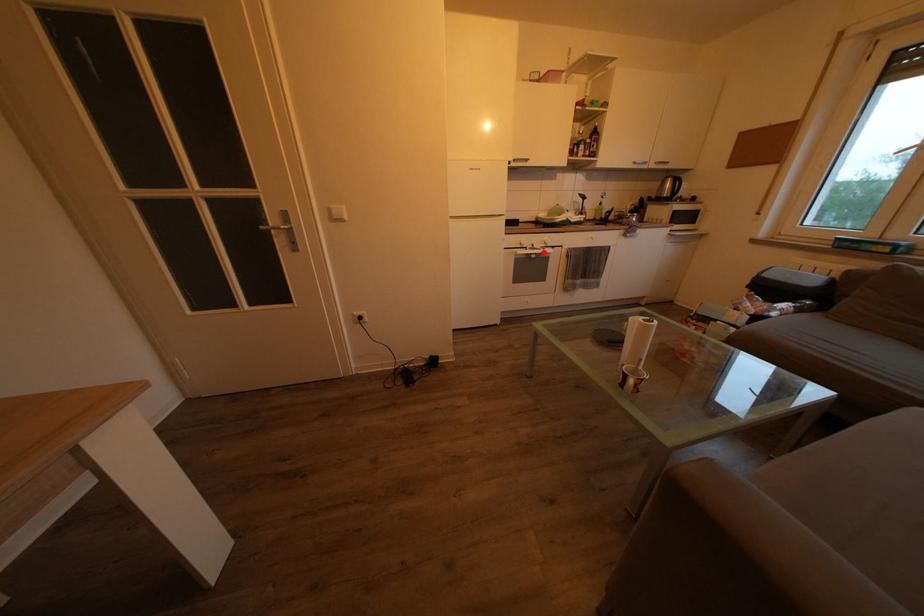
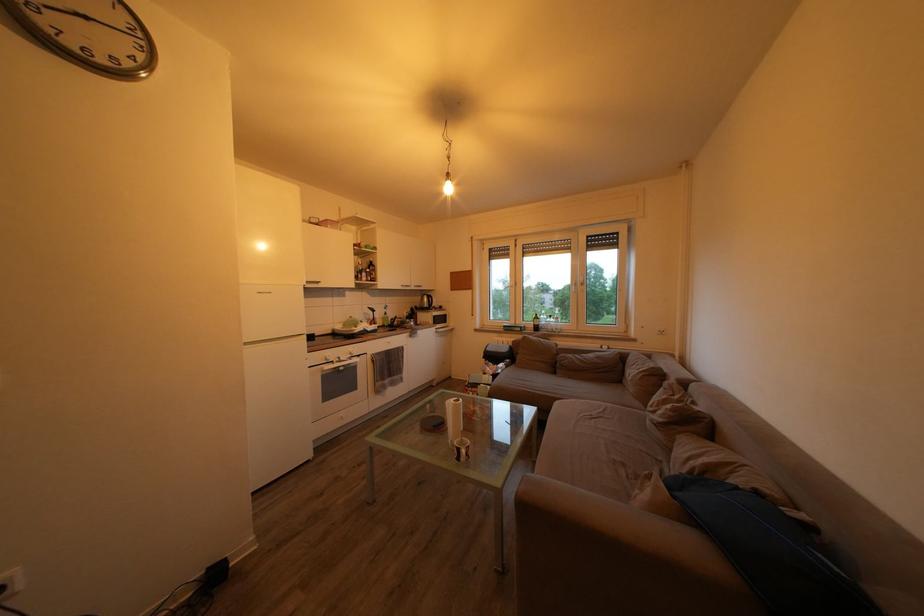
Where in the second image is the point corresponding to the highlighted location from the first image?

(349, 363)